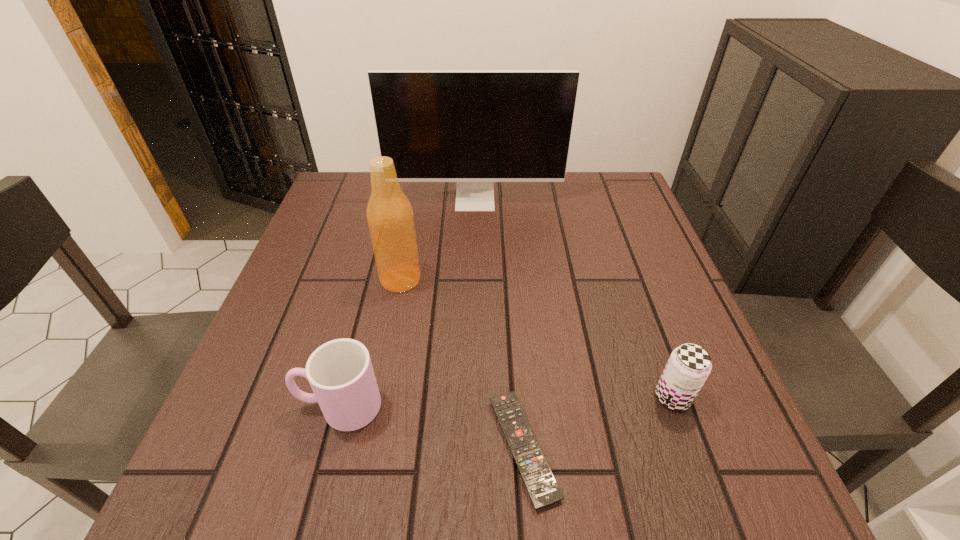
Choose which object is the second nearest neighbor to the cup. Please provide its 2D coordinates. Your answer should be formatted as a tuple, i.e. [(x, y)], where the tuple contains the x and y coordinates of a point satisfying the conditions above.

[(389, 214)]

The image size is (960, 540). Identify the location of vacant region that satisfies the following two spatial constraints: 1. on the back side of the rightmost object; 2. on the left side of the remote control. (x=519, y=397).

The height and width of the screenshot is (540, 960). I want to click on free location that satisfies the following two spatial constraints: 1. on the front side of the beer bottle; 2. on the right side of the shortest object, so click(368, 448).

At what (x,y) coordinates should I click in order to perform the action: click on free space that satisfies the following two spatial constraints: 1. with the handle on the side of the beer bottle; 2. on the right side of the cup. Please return your answer as a coordinate pair (x, y). This screenshot has width=960, height=540. Looking at the image, I should click on (372, 279).

Where is `free location that satisfies the following two spatial constraints: 1. with the handle on the side of the rightmost object; 2. on the left side of the cup`? free location that satisfies the following two spatial constraints: 1. with the handle on the side of the rightmost object; 2. on the left side of the cup is located at coordinates (342, 397).